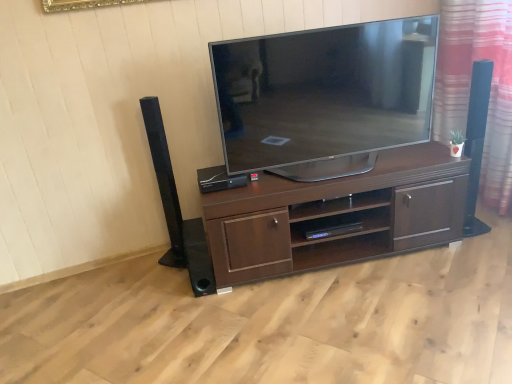
What do you see at coordinates (470, 82) in the screenshot? I see `velvet-like red curtain at right` at bounding box center [470, 82].

The width and height of the screenshot is (512, 384). I want to click on black plastic speaker at center, which is the third speaker in left-to-right order, so click(x=218, y=179).

Describe the element at coordinates (340, 224) in the screenshot. I see `black plastic shelf at center` at that location.

You are a GUI agent. You are given a task and a screenshot of the screen. Output one action in this format:
    pyautogui.click(x=<x>, y=<y>)
    Task: Click on the black matte speaker at left, the 1th speaker from the left
    
    Given the screenshot: What is the action you would take?
    tap(164, 181)

Where is `black matte speaker at lower center, the 2th speaker from the right`? The width and height of the screenshot is (512, 384). black matte speaker at lower center, the 2th speaker from the right is located at coordinates (198, 258).

Locate an element on the screen. This screenshot has width=512, height=384. velvet-like red curtain at right is located at coordinates (470, 82).

From the image's perspective, does black plastic speaker at center, which is the third speaker in left-to-right order, appear lower than black plastic shelf at center?

Incorrect, from the image's perspective, black plastic speaker at center, which is the third speaker in left-to-right order, is higher than black plastic shelf at center.

Can you see black plastic speaker at center, which is the third speaker in left-to-right order, touching black plastic shelf at center?

black plastic speaker at center, which is the third speaker in left-to-right order, and black plastic shelf at center are clearly separated.

How distant is black plastic speaker at center, arranged as the 1th speaker when viewed from the right, from black plastic shelf at center?

58.22 centimeters.

Is black plastic shelf at center at the back of black plastic speaker at center, which is the third speaker in left-to-right order?

No, black plastic speaker at center, which is the third speaker in left-to-right order, is not facing away from black plastic shelf at center.

Looking at this image, considering the sizes of objects black plastic speaker at center, which is the third speaker in left-to-right order, and black matte speaker at lower center, acting as the 2th speaker starting from the left, in the image provided, who is bigger, black plastic speaker at center, which is the third speaker in left-to-right order, or black matte speaker at lower center, acting as the 2th speaker starting from the left,?

black matte speaker at lower center, acting as the 2th speaker starting from the left, is bigger.

From the picture: Between black plastic speaker at center, arranged as the 1th speaker when viewed from the right, and black matte speaker at lower center, acting as the 2th speaker starting from the left, which one has more height?

With more height is black matte speaker at lower center, acting as the 2th speaker starting from the left.

You are a GUI agent. You are given a task and a screenshot of the screen. Output one action in this format:
    pyautogui.click(x=<x>, y=<y>)
    Task: Click on the speaker behind the black matte speaker at lower center, the 2th speaker from the right
    This screenshot has width=512, height=384.
    Given the screenshot: What is the action you would take?
    pyautogui.click(x=218, y=179)

From a real-world perspective, is black plastic speaker at center, arranged as the 1th speaker when viewed from the right, physically located above or below black matte speaker at lower center, the 2th speaker from the right?

In terms of real-world spatial position, black plastic speaker at center, arranged as the 1th speaker when viewed from the right, is above black matte speaker at lower center, the 2th speaker from the right.

Is velvet-like red curtain at right smaller than satin black tv at center?

Yes.

From a real-world perspective, is velvet-like red curtain at right over satin black tv at center?

No, from a real-world perspective, velvet-like red curtain at right is not above satin black tv at center.

Considering the positions of objects velvet-like red curtain at right and satin black tv at center in the image provided, who is more to the left, velvet-like red curtain at right or satin black tv at center?

satin black tv at center.

Would you consider satin black tv at center to be distant from dark brown wood tv stand at center?

satin black tv at center is near dark brown wood tv stand at center, not far away.

Does satin black tv at center have a smaller size compared to dark brown wood tv stand at center?

Yes.

The width and height of the screenshot is (512, 384). What are the coordinates of `desk behind the satin black tv at center` in the screenshot? It's located at (336, 215).

From a real-world perspective, does satin black tv at center stand above dark brown wood tv stand at center?

Correct, in the physical world, satin black tv at center is higher than dark brown wood tv stand at center.

This screenshot has height=384, width=512. I want to click on speaker that is the 3rd object located in front of the black plastic shelf at center, so click(x=164, y=181).

Is black matte speaker at left, positioned as the 3th speaker in right-to-left order, shorter than black plastic shelf at center?

No.

Considering the relative positions of black matte speaker at left, the 1th speaker from the left, and black plastic shelf at center in the image provided, is black matte speaker at left, the 1th speaker from the left, to the right of black plastic shelf at center from the viewer's perspective?

No, black matte speaker at left, the 1th speaker from the left, is not to the right of black plastic shelf at center.

Could you tell me if black matte speaker at left, the 1th speaker from the left, is turned towards black plastic shelf at center?

No, black matte speaker at left, the 1th speaker from the left, is not turned towards black plastic shelf at center.

Is black plastic shelf at center oriented away from dark brown wood tv stand at center?

Absolutely, black plastic shelf at center is directed away from dark brown wood tv stand at center.

Which of these two, black plastic shelf at center or dark brown wood tv stand at center, is thinner?

black plastic shelf at center.

From the picture: Which of these two, black plastic shelf at center or dark brown wood tv stand at center, stands taller?

With more height is dark brown wood tv stand at center.

Identify the location of desk to the right of black plastic shelf at center. (336, 215).

Does black matte speaker at left, positioned as the 3th speaker in right-to-left order, have a greater width compared to dark brown wood tv stand at center?

No.

Which is closer, (147, 126) or (217, 220)?

Positioned in front is point (217, 220).

Is black matte speaker at left, the 1th speaker from the left, positioned far away from dark brown wood tv stand at center?

black matte speaker at left, the 1th speaker from the left, is actually quite close to dark brown wood tv stand at center.

From a real-world perspective, which speaker is the 2nd one above the black plastic shelf at center? Please provide its 2D coordinates.

[(218, 179)]

Where is `speaker that is the 2nd object located above the black matte speaker at lower center, acting as the 2th speaker starting from the left (from the image's perspective)`? speaker that is the 2nd object located above the black matte speaker at lower center, acting as the 2th speaker starting from the left (from the image's perspective) is located at coordinates [x=218, y=179].

Considering their positions, is dark brown wood tv stand at center positioned closer to black plastic speaker at center, arranged as the 1th speaker when viewed from the right, than velvet-like red curtain at right?

dark brown wood tv stand at center is closer to black plastic speaker at center, arranged as the 1th speaker when viewed from the right.

Based on their spatial positions, is black matte speaker at lower center, the 2th speaker from the right, or black matte speaker at left, the 1th speaker from the left, further from dark brown wood tv stand at center?

black matte speaker at left, the 1th speaker from the left, is further to dark brown wood tv stand at center.

Looking at the image, which one is located further to velvet-like red curtain at right, black matte speaker at left, the 1th speaker from the left, or black plastic speaker at center, arranged as the 1th speaker when viewed from the right?

Among the two, black matte speaker at left, the 1th speaker from the left, is located further to velvet-like red curtain at right.

Estimate the real-world distances between objects in this image. Which object is further from velvet-like red curtain at right, black matte speaker at left, the 1th speaker from the left, or satin black tv at center?

black matte speaker at left, the 1th speaker from the left.

When comparing their distances from black matte speaker at left, the 1th speaker from the left, does velvet-like red curtain at right or dark brown wood tv stand at center seem closer?

The object closer to black matte speaker at left, the 1th speaker from the left, is dark brown wood tv stand at center.

When comparing their distances from black plastic speaker at center, which is the third speaker in left-to-right order, does velvet-like red curtain at right or dark brown wood tv stand at center seem closer?

dark brown wood tv stand at center lies closer to black plastic speaker at center, which is the third speaker in left-to-right order, than the other object.

Which object lies further to the anchor point satin black tv at center, black matte speaker at left, positioned as the 3th speaker in right-to-left order, or black plastic shelf at center?

black matte speaker at left, positioned as the 3th speaker in right-to-left order.

Based on the photo, from the image, which object appears to be nearer to black matte speaker at left, the 1th speaker from the left, dark brown wood tv stand at center or black plastic speaker at center, which is the third speaker in left-to-right order?

Among the two, black plastic speaker at center, which is the third speaker in left-to-right order, is located nearer to black matte speaker at left, the 1th speaker from the left.

The image size is (512, 384). I want to click on desk between black matte speaker at left, the 1th speaker from the left, and velvet-like red curtain at right from left to right, so click(x=336, y=215).

This screenshot has width=512, height=384. What are the coordinates of `shelf between black plastic speaker at center, which is the third speaker in left-to-right order, and dark brown wood tv stand at center` in the screenshot? It's located at (340, 224).

I want to click on desk situated between satin black tv at center and velvet-like red curtain at right from left to right, so click(x=336, y=215).

The image size is (512, 384). Find the location of `speaker between black matte speaker at lower center, the 2th speaker from the right, and dark brown wood tv stand at center`. speaker between black matte speaker at lower center, the 2th speaker from the right, and dark brown wood tv stand at center is located at coordinates (218, 179).